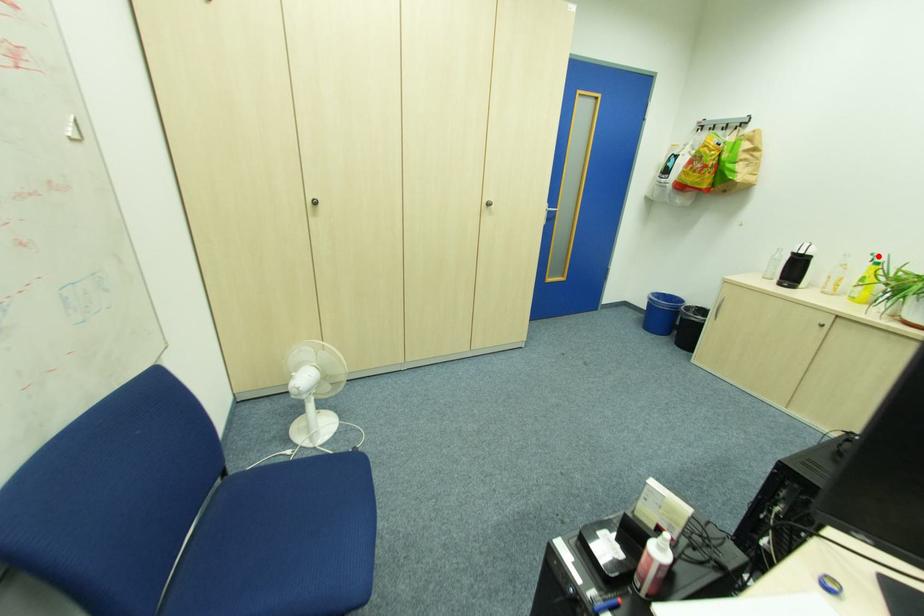
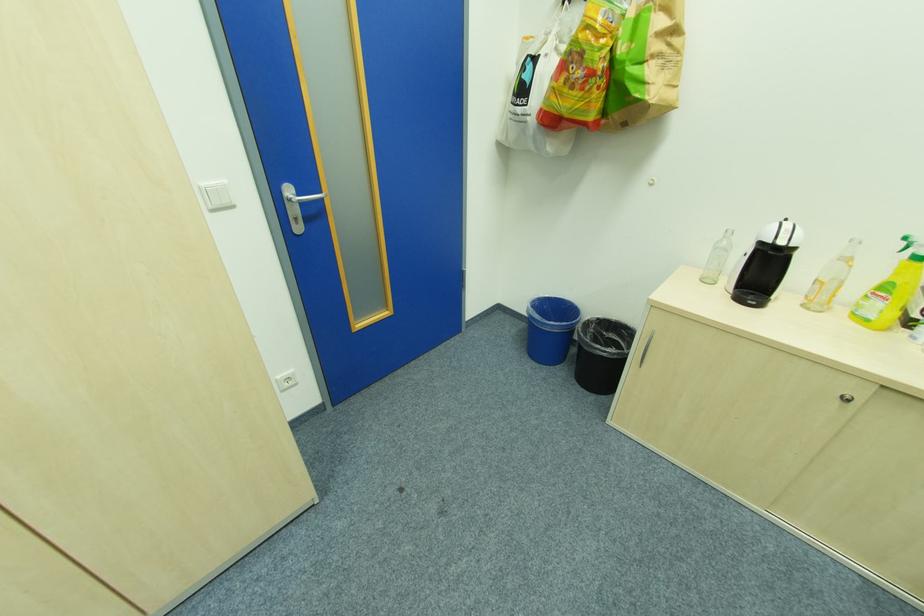
Question: I am providing you with two images of the same scene from different viewpoints. A red point is marked on the first image. Can you still see the location of the red point in image 2?

Choices:
 (A) Yes
 (B) No

Answer: (A)